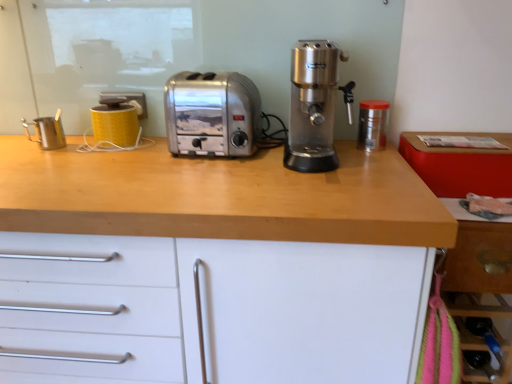
Locate an element on the screen. Image resolution: width=512 pixels, height=384 pixels. free location in front of satin silver coffee machine at center is located at coordinates (331, 177).